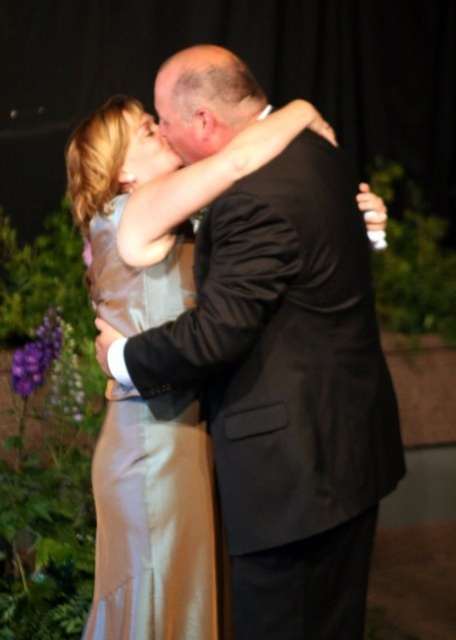
Question: Which object is the closest to the satin dress at center?

Choices:
 (A) bald head at center
 (B) satin dress at left

Answer: (B)

Question: Which of these objects is positioned farthest from the satin dress at left?

Choices:
 (A) bald head at center
 (B) satin dress at center

Answer: (A)

Question: Can you confirm if satin dress at center is positioned below bald head at center?

Choices:
 (A) yes
 (B) no

Answer: (A)

Question: Is satin dress at left bigger than bald head at center?

Choices:
 (A) no
 (B) yes

Answer: (B)

Question: Does satin dress at center appear on the right side of bald head at center?

Choices:
 (A) no
 (B) yes

Answer: (B)

Question: Which is nearer to the satin dress at center?

Choices:
 (A) satin dress at left
 (B) bald head at center

Answer: (A)